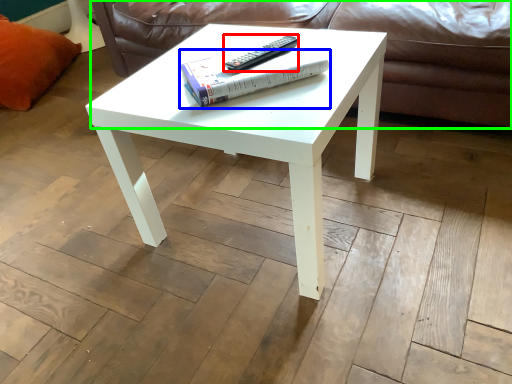
Question: Which is farther away from remote (highlighted by a red box)? paperback book (highlighted by a blue box) or couch (highlighted by a green box)?

Choices:
 (A) paperback book
 (B) couch

Answer: (B)